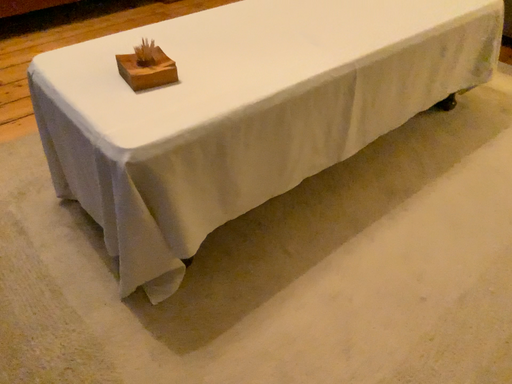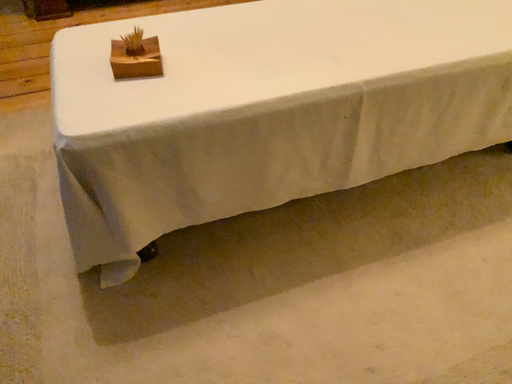
Question: How did the camera likely rotate when shooting the video?

Choices:
 (A) rotated left
 (B) rotated right

Answer: (A)